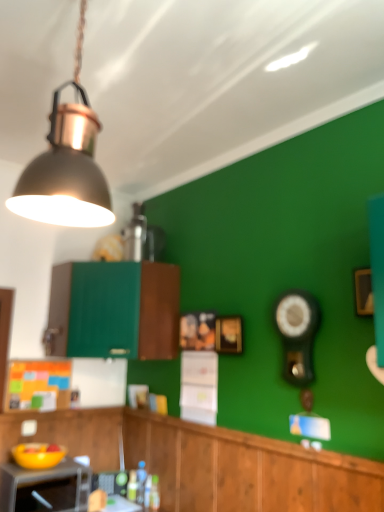
Question: Would you say matte black microwave at lower left is outside black glossy clock at right?

Choices:
 (A) yes
 (B) no

Answer: (A)

Question: Considering the relative sizes of matte black microwave at lower left and black glossy clock at right in the image provided, is matte black microwave at lower left smaller than black glossy clock at right?

Choices:
 (A) no
 (B) yes

Answer: (A)

Question: Is matte black microwave at lower left oriented towards black glossy clock at right?

Choices:
 (A) no
 (B) yes

Answer: (A)

Question: From the image's perspective, is matte black microwave at lower left located beneath black glossy clock at right?

Choices:
 (A) yes
 (B) no

Answer: (A)

Question: Is matte black microwave at lower left to the left of black glossy clock at right from the viewer's perspective?

Choices:
 (A) yes
 (B) no

Answer: (A)

Question: Is point (33, 210) positioned closer to the camera than point (216, 334)?

Choices:
 (A) farther
 (B) closer

Answer: (B)

Question: From a real-world perspective, is metallic gray lampshade at upper left physically located above or below gold metallic picture frame at center?

Choices:
 (A) below
 (B) above

Answer: (B)

Question: Looking at the image, does metallic gray lampshade at upper left seem bigger or smaller compared to gold metallic picture frame at center?

Choices:
 (A) small
 (B) big

Answer: (B)

Question: Looking at their shapes, would you say metallic gray lampshade at upper left is wider or thinner than gold metallic picture frame at center?

Choices:
 (A) wide
 (B) thin

Answer: (A)

Question: Is translucent plastic bottle at lower center taller or shorter than matte black microwave at lower left?

Choices:
 (A) short
 (B) tall

Answer: (A)

Question: Is translucent plastic bottle at lower center bigger or smaller than matte black microwave at lower left?

Choices:
 (A) big
 (B) small

Answer: (B)

Question: Which is correct: translucent plastic bottle at lower center is inside matte black microwave at lower left, or outside of it?

Choices:
 (A) inside
 (B) outside

Answer: (B)

Question: Relative to matte black microwave at lower left, is translucent plastic bottle at lower center in front or behind?

Choices:
 (A) behind
 (B) front

Answer: (A)

Question: Is black glossy clock at right inside or outside of translucent plastic bottle at lower center?

Choices:
 (A) inside
 (B) outside

Answer: (B)

Question: Is black glossy clock at right to the left or to the right of translucent plastic bottle at lower center in the image?

Choices:
 (A) left
 (B) right

Answer: (B)